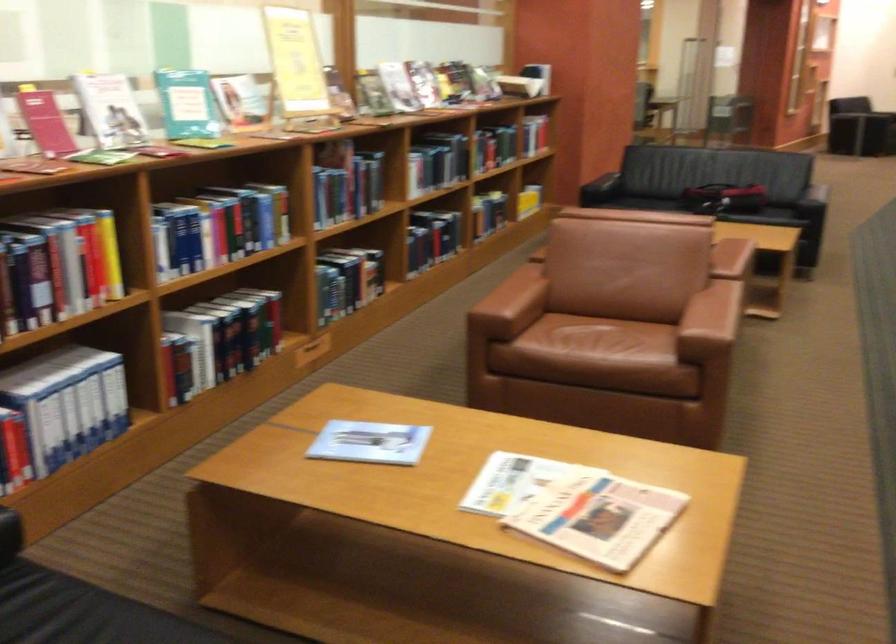
What do you see at coordinates (600, 182) in the screenshot? I see `the sofa armrest` at bounding box center [600, 182].